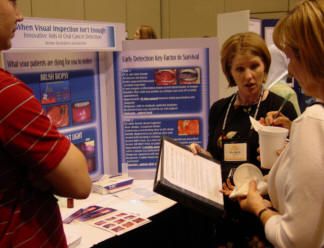
You are a GUI agent. You are given a task and a screenshot of the screen. Output one action in this format:
    pyautogui.click(x=<x>, y=<y>)
    Task: Click on the display
    
    Given the screenshot: What is the action you would take?
    coord(157,98)